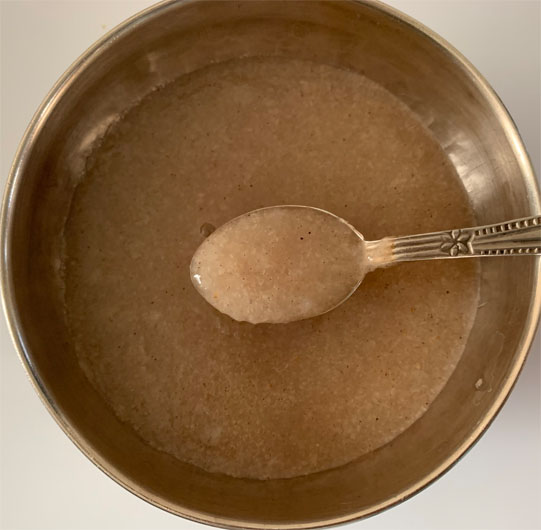
I want to click on light reflecting on bowl, so click(469, 166), click(509, 137).